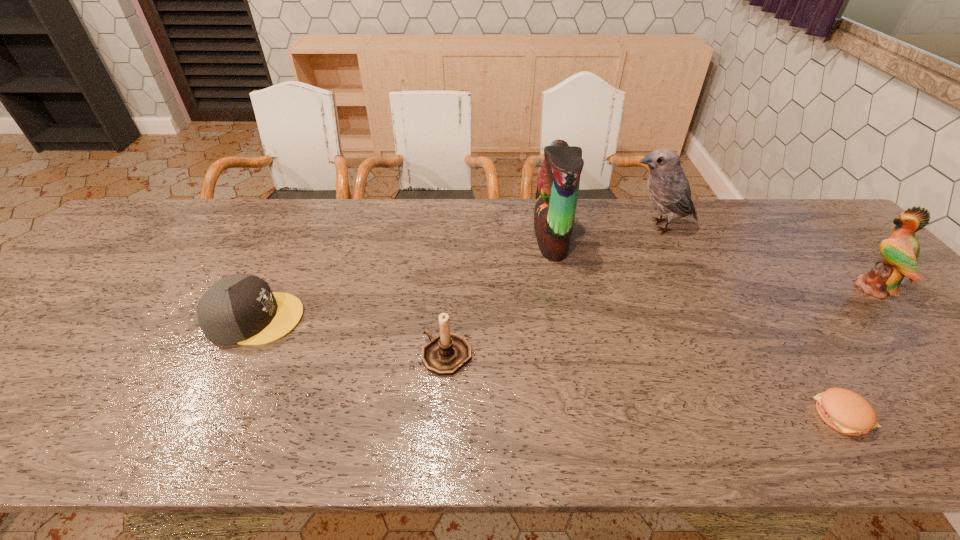
Identify the location of unoccupied area between the third object from right to left and the leftmost object. (457, 272).

I want to click on vacant area that lies between the leftmost parrot and the fifth tallest object, so click(x=403, y=279).

Locate an element on the screen. The width and height of the screenshot is (960, 540). free space that is in between the leftmost object and the patty is located at coordinates (x=548, y=367).

In order to click on free spot between the second object from left to right and the rightmost object in this screenshot , I will do `click(660, 322)`.

You are a GUI agent. You are given a task and a screenshot of the screen. Output one action in this format:
    pyautogui.click(x=<x>, y=<y>)
    Task: Click on the free spot between the fourth object from right to left and the fifth tallest object
    This screenshot has height=540, width=960.
    Given the screenshot: What is the action you would take?
    pyautogui.click(x=403, y=279)

This screenshot has width=960, height=540. Identify the location of empty space between the rightmost parrot and the second object from right to left. (856, 352).

Identify the location of free space between the nearest parrot and the candle holder. The image size is (960, 540). 660,322.

The image size is (960, 540). I want to click on free space between the fourth object from right to left and the second object from right to left, so click(696, 327).

Where is `object that can be found as the fourth closest to the rightmost object`? Image resolution: width=960 pixels, height=540 pixels. object that can be found as the fourth closest to the rightmost object is located at coordinates (445, 354).

Locate which object ranks in proximity to the second shortest object. Please provide its 2D coordinates. Your answer should be formatted as a tuple, i.e. [(x, y)], where the tuple contains the x and y coordinates of a point satisfying the conditions above.

[(445, 354)]